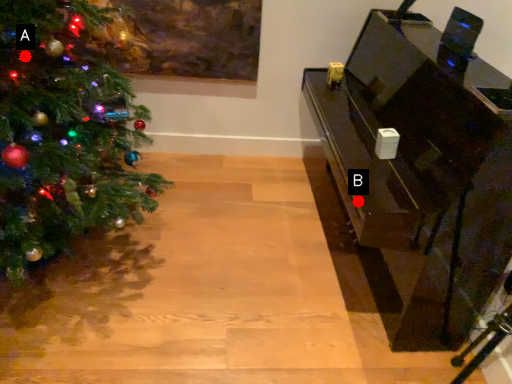
Question: Two points are circled on the image, labeled by A and B beside each circle. Which of the following is the closest to the observer?

Choices:
 (A) A is closer
 (B) B is closer

Answer: (A)